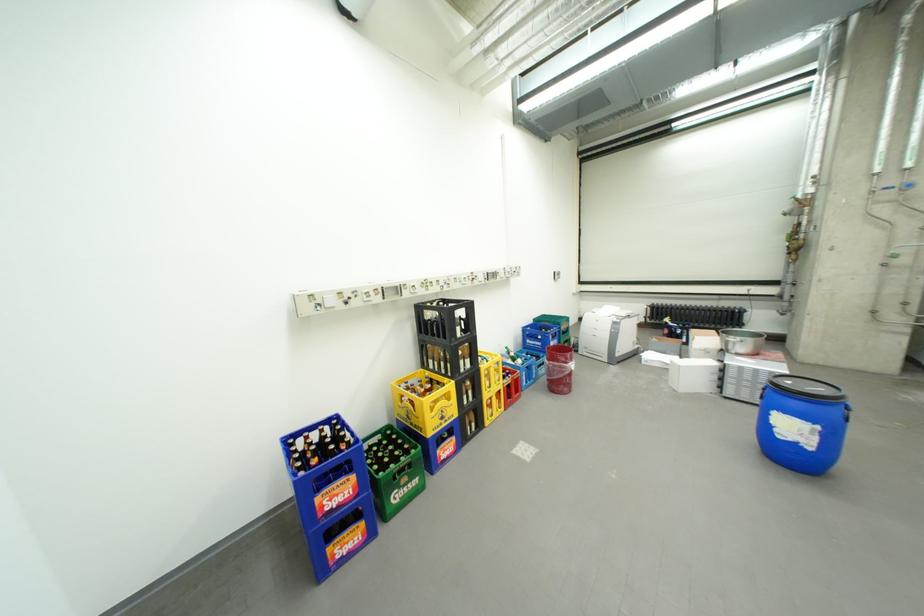
You are a GUI agent. You are given a task and a screenshot of the screen. Output one action in this format:
    pyautogui.click(x=<x>, y=<y>)
    Task: Click on the large metal bowl
    The width and height of the screenshot is (924, 616).
    Given the screenshot: What is the action you would take?
    pyautogui.click(x=742, y=341)